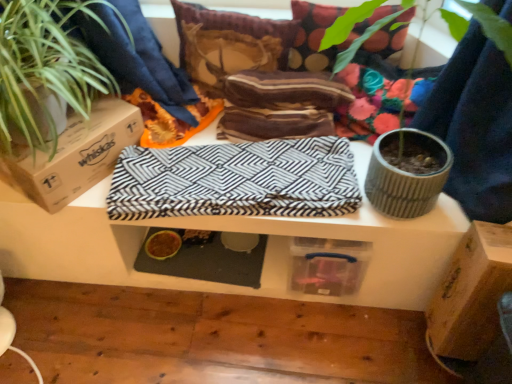
Where is `vacant point to the right of yellow rubber food bowl at lower center`? The width and height of the screenshot is (512, 384). vacant point to the right of yellow rubber food bowl at lower center is located at coordinates (200, 259).